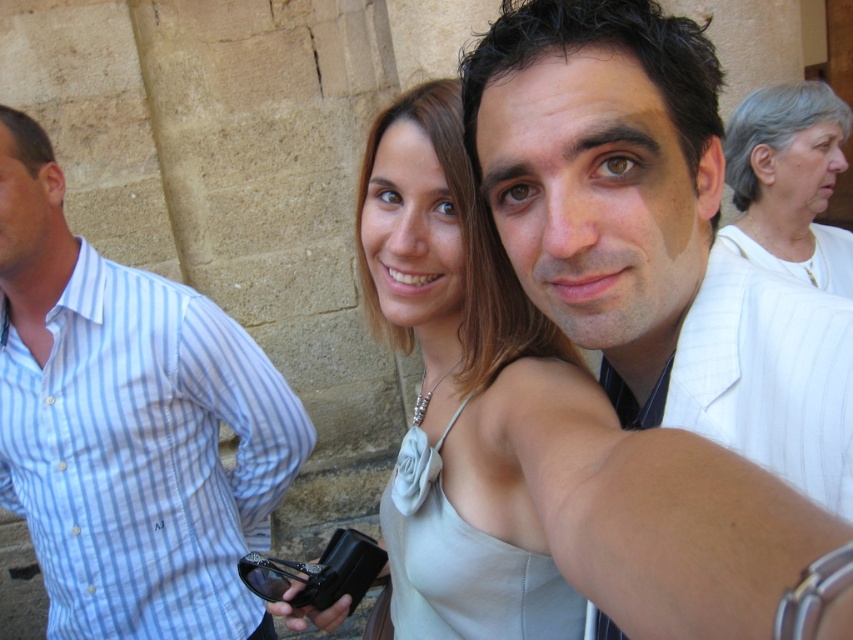
Is point (38, 388) in front of point (735, 225)?

Yes, it is.

Is blue striped shirt at left further to the viewer compared to white fabric at upper right?

No, blue striped shirt at left is closer to the viewer.

Image resolution: width=853 pixels, height=640 pixels. What do you see at coordinates (129, 426) in the screenshot? I see `blue striped shirt at left` at bounding box center [129, 426].

Where is `blue striped shirt at left`? blue striped shirt at left is located at coordinates (129, 426).

Is white fabric at upper right wider than black plastic camera at center?

Indeed, white fabric at upper right has a greater width compared to black plastic camera at center.

Consider the image. Is white fabric at upper right thinner than black plastic camera at center?

In fact, white fabric at upper right might be wider than black plastic camera at center.

Does point (808, 118) lie behind point (341, 593)?

Yes, it is.

You are a GUI agent. You are given a task and a screenshot of the screen. Output one action in this format:
    pyautogui.click(x=<x>, y=<y>)
    Task: Click on the white fabric at upper right
    
    Given the screenshot: What is the action you would take?
    pyautogui.click(x=788, y=180)

Where is `blue striped shirt at left`? This screenshot has height=640, width=853. blue striped shirt at left is located at coordinates (129, 426).

Can you confirm if blue striped shirt at left is thinner than black plastic camera at center?

Incorrect, blue striped shirt at left's width is not less than black plastic camera at center's.

Between point (170, 609) and point (352, 561), which one is positioned in front?

Point (352, 561) is more forward.

This screenshot has height=640, width=853. What are the coordinates of `blue striped shirt at left` in the screenshot? It's located at (129, 426).